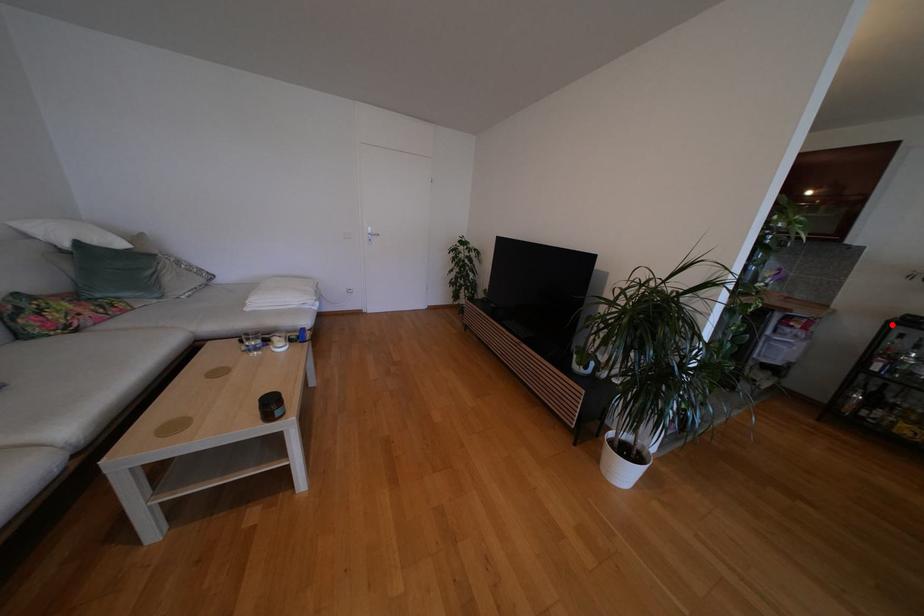
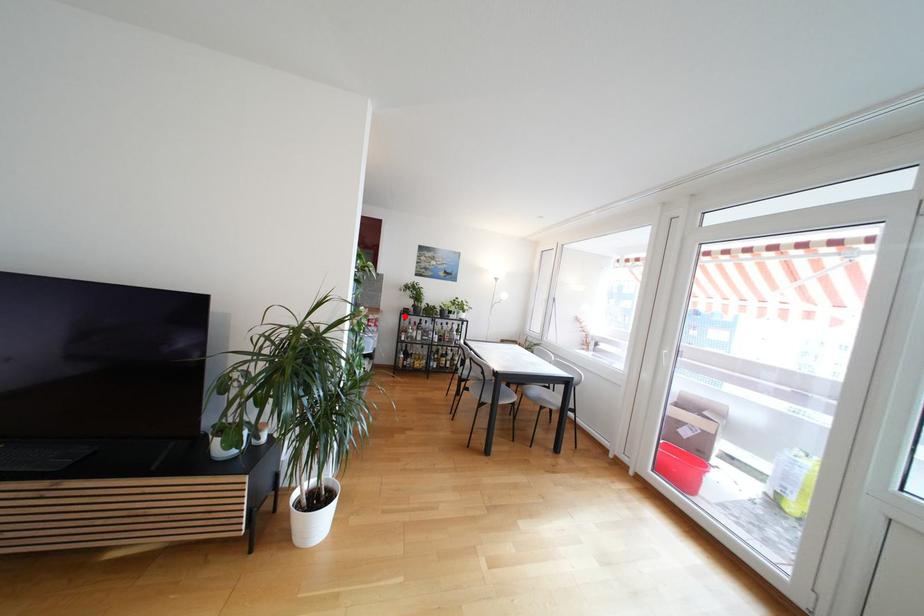
I am providing you with two images of the same scene from different viewpoints. A red point is marked on the first image and another point is marked on the second image. Do the highlighted points in image1 and image2 indicate the same real-world spot?

Yes